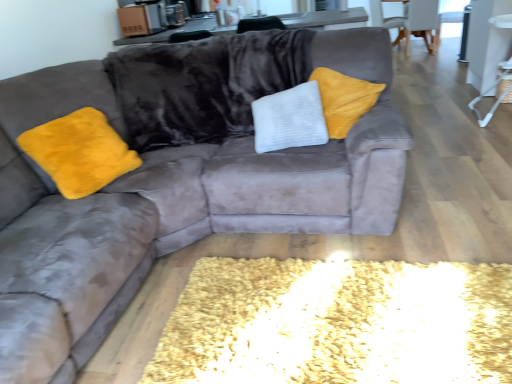
Image resolution: width=512 pixels, height=384 pixels. What do you see at coordinates (396, 26) in the screenshot?
I see `velvet gray armchair at upper right, arranged as the 2th armchair when viewed from the front` at bounding box center [396, 26].

Where is `white plastic side table at right`? The height and width of the screenshot is (384, 512). white plastic side table at right is located at coordinates (489, 90).

Find the location of a particular element. This screenshot has width=512, height=384. white fabric armchair at upper right, the 1th armchair from the front is located at coordinates (419, 24).

From a real-world perspective, who is located lower, white fabric armchair at upper right, the 1th armchair from the front, or white plastic side table at right?

white fabric armchair at upper right, the 1th armchair from the front.

Is point (417, 12) less distant than point (508, 87)?

No, it is behind (508, 87).

Is white fabric armchair at upper right, the 1th armchair from the front, turned away from white plastic side table at right?

Correct, white fabric armchair at upper right, the 1th armchair from the front, is looking away from white plastic side table at right.

Can you see white fabric armchair at upper right, the second armchair when ordered from back to front, touching white plastic side table at right?

There is a gap between white fabric armchair at upper right, the second armchair when ordered from back to front, and white plastic side table at right.

From the image's perspective, would you say velvet gray armchair at upper right, which appears as the 1th armchair when viewed from the back, is shown under white fabric armchair at upper right, the 1th armchair from the front?

Incorrect, from the image's perspective, velvet gray armchair at upper right, which appears as the 1th armchair when viewed from the back, is higher than white fabric armchair at upper right, the 1th armchair from the front.

Locate an element on the screen. Image resolution: width=512 pixels, height=384 pixels. armchair on the left of white fabric armchair at upper right, the 1th armchair from the front is located at coordinates (396, 26).

How distant is velvet gray armchair at upper right, which appears as the 1th armchair when viewed from the back, from white fabric armchair at upper right, the second armchair when ordered from back to front?

velvet gray armchair at upper right, which appears as the 1th armchair when viewed from the back, and white fabric armchair at upper right, the second armchair when ordered from back to front, are 6.89 inches apart.

Can you tell me how much velvet gray armchair at upper right, arranged as the 2th armchair when viewed from the front, and white fabric armchair at upper right, the 1th armchair from the front, differ in facing direction?

They differ by 68.2 degrees in their facing directions.

Does velvet gray armchair at upper right, arranged as the 2th armchair when viewed from the front, come behind white plastic side table at right?

That is True.

How many degrees apart are the facing directions of velvet gray armchair at upper right, arranged as the 2th armchair when viewed from the front, and white plastic side table at right?

162 degrees separate the facing orientations of velvet gray armchair at upper right, arranged as the 2th armchair when viewed from the front, and white plastic side table at right.

Based on the photo, is velvet gray armchair at upper right, which appears as the 1th armchair when viewed from the back, wider or thinner than white plastic side table at right?

Considering their sizes, velvet gray armchair at upper right, which appears as the 1th armchair when viewed from the back, looks broader than white plastic side table at right.

Is white plastic side table at right surrounded by velvet gray armchair at upper right, arranged as the 2th armchair when viewed from the front?

No, white plastic side table at right is located outside of velvet gray armchair at upper right, arranged as the 2th armchair when viewed from the front.

Considering the relative sizes of white plastic side table at right and velvet gray armchair at upper right, which appears as the 1th armchair when viewed from the back, in the image provided, is white plastic side table at right smaller than velvet gray armchair at upper right, which appears as the 1th armchair when viewed from the back,?

Indeed, white plastic side table at right has a smaller size compared to velvet gray armchair at upper right, which appears as the 1th armchair when viewed from the back.

Considering the positions of objects white plastic side table at right and velvet gray armchair at upper right, which appears as the 1th armchair when viewed from the back, in the image provided, who is more to the right, white plastic side table at right or velvet gray armchair at upper right, which appears as the 1th armchair when viewed from the back,?

velvet gray armchair at upper right, which appears as the 1th armchair when viewed from the back.

Does white plastic side table at right have a greater height compared to velvet gray armchair at upper right, which appears as the 1th armchair when viewed from the back?

Yes, white plastic side table at right is taller than velvet gray armchair at upper right, which appears as the 1th armchair when viewed from the back.

Is white fabric armchair at upper right, the 1th armchair from the front, to the left or to the right of velvet gray armchair at upper right, arranged as the 2th armchair when viewed from the front, in the image?

From the image, it's evident that white fabric armchair at upper right, the 1th armchair from the front, is to the right of velvet gray armchair at upper right, arranged as the 2th armchair when viewed from the front.

Is white fabric armchair at upper right, the second armchair when ordered from back to front, facing away from velvet gray armchair at upper right, which appears as the 1th armchair when viewed from the back?

No, white fabric armchair at upper right, the second armchair when ordered from back to front, is not facing the opposite direction of velvet gray armchair at upper right, which appears as the 1th armchair when viewed from the back.

Does white fabric armchair at upper right, the second armchair when ordered from back to front, come behind velvet gray armchair at upper right, which appears as the 1th armchair when viewed from the back?

No.

Is white fabric armchair at upper right, the 1th armchair from the front, not close to velvet gray armchair at upper right, arranged as the 2th armchair when viewed from the front?

white fabric armchair at upper right, the 1th armchair from the front, is near velvet gray armchair at upper right, arranged as the 2th armchair when viewed from the front, not far away.

Considering the sizes of objects white plastic side table at right and white fabric armchair at upper right, the second armchair when ordered from back to front, in the image provided, who is thinner, white plastic side table at right or white fabric armchair at upper right, the second armchair when ordered from back to front,?

white plastic side table at right is thinner.

Which is nearer, (495,103) or (431,52)?

The point (495,103) is in front.

From the picture: Does white plastic side table at right have a greater height compared to white fabric armchair at upper right, the 1th armchair from the front?

Indeed, white plastic side table at right has a greater height compared to white fabric armchair at upper right, the 1th armchair from the front.

Is white plastic side table at right aimed at white fabric armchair at upper right, the second armchair when ordered from back to front?

No.

Identify the location of side table above the white fabric armchair at upper right, the second armchair when ordered from back to front (from a real-world perspective). (489, 90).

Find the location of `armchair located behind the white fabric armchair at upper right, the second armchair when ordered from back to front`. armchair located behind the white fabric armchair at upper right, the second armchair when ordered from back to front is located at coordinates click(396, 26).

From the picture: Looking at the image, which one is located closer to white fabric armchair at upper right, the 1th armchair from the front, white plastic side table at right or velvet gray armchair at upper right, which appears as the 1th armchair when viewed from the back?

velvet gray armchair at upper right, which appears as the 1th armchair when viewed from the back.

Estimate the real-world distances between objects in this image. Which object is further from velvet gray armchair at upper right, arranged as the 2th armchair when viewed from the front, white fabric armchair at upper right, the second armchair when ordered from back to front, or white plastic side table at right?

white plastic side table at right.

In the scene shown: Estimate the real-world distances between objects in this image. Which object is closer to white fabric armchair at upper right, the second armchair when ordered from back to front, velvet gray armchair at upper right, arranged as the 2th armchair when viewed from the front, or white plastic side table at right?

Among the two, velvet gray armchair at upper right, arranged as the 2th armchair when viewed from the front, is located nearer to white fabric armchair at upper right, the second armchair when ordered from back to front.

When comparing their distances from white plastic side table at right, does white fabric armchair at upper right, the 1th armchair from the front, or velvet gray armchair at upper right, arranged as the 2th armchair when viewed from the front, seem further?

The object further to white plastic side table at right is velvet gray armchair at upper right, arranged as the 2th armchair when viewed from the front.

Looking at the image, which one is located closer to white plastic side table at right, velvet gray armchair at upper right, arranged as the 2th armchair when viewed from the front, or white fabric armchair at upper right, the second armchair when ordered from back to front?

The object closer to white plastic side table at right is white fabric armchair at upper right, the second armchair when ordered from back to front.

Based on their spatial positions, is white plastic side table at right or white fabric armchair at upper right, the 1th armchair from the front, closer to velvet gray armchair at upper right, which appears as the 1th armchair when viewed from the back?

The object closer to velvet gray armchair at upper right, which appears as the 1th armchair when viewed from the back, is white fabric armchair at upper right, the 1th armchair from the front.

This screenshot has width=512, height=384. Find the location of `armchair between white plastic side table at right and velvet gray armchair at upper right, arranged as the 2th armchair when viewed from the front, along the z-axis`. armchair between white plastic side table at right and velvet gray armchair at upper right, arranged as the 2th armchair when viewed from the front, along the z-axis is located at coordinates (419, 24).